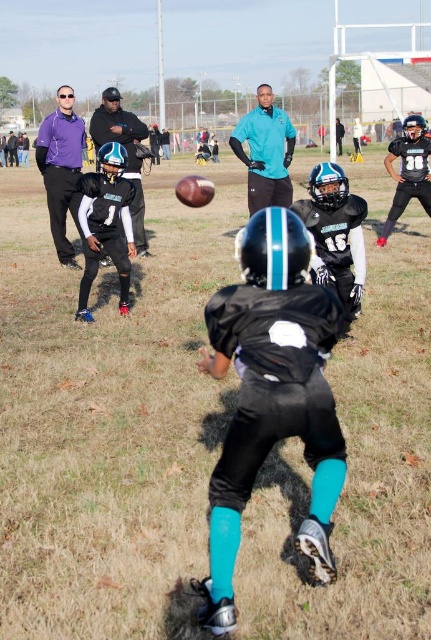
Based on the photo, you are a photographer standing at the camera position. You want to capture a closeup shot of the point at coordinates (61, 172). Given that your camera can focus on objects within 25 feet, will you be able to focus on that point?

The point at coordinates (61, 172) is 27.59 feet from the camera, which is beyond the camera focus range of 25 feet. Therefore, the camera cannot focus on that point.

You are a photographer standing behind the football field. You want to take a photo that includes both the purple matte shirt at left and the matte black helmet at center. Which object should you adjust your camera focus to first to ensure both are in the frame?

The purple matte shirt at left is closer to you than the matte black helmet at center, so you should focus on the purple matte shirt at left first to ensure both are in the frame.